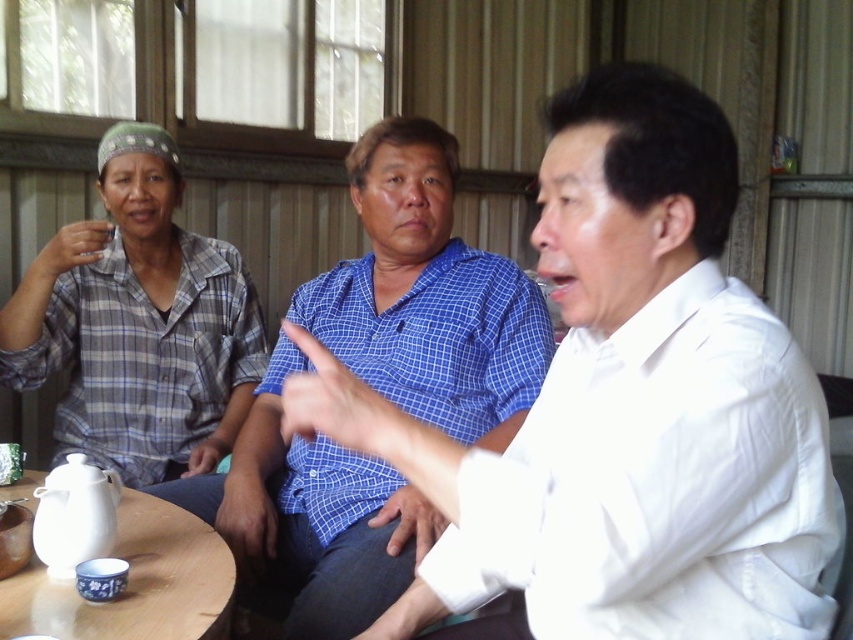
Question: Can you confirm if white cotton shirt at center is positioned above blue checkered shirt at center?

Choices:
 (A) no
 (B) yes

Answer: (A)

Question: Which point is farther from the camera taking this photo?

Choices:
 (A) (172, 413)
 (B) (244, 540)

Answer: (A)

Question: Among these objects, which one is farthest from the camera?

Choices:
 (A) white cotton shirt at center
 (B) white wood round table at lower left

Answer: (B)

Question: Can you confirm if white cotton shirt at center is positioned below plaid fabric shirt at left?

Choices:
 (A) no
 (B) yes

Answer: (B)

Question: Is white cotton shirt at center closer to the viewer compared to white wood round table at lower left?

Choices:
 (A) yes
 (B) no

Answer: (A)

Question: Which object is the farthest from the white cotton shirt at center?

Choices:
 (A) white wood round table at lower left
 (B) plaid fabric shirt at left

Answer: (B)